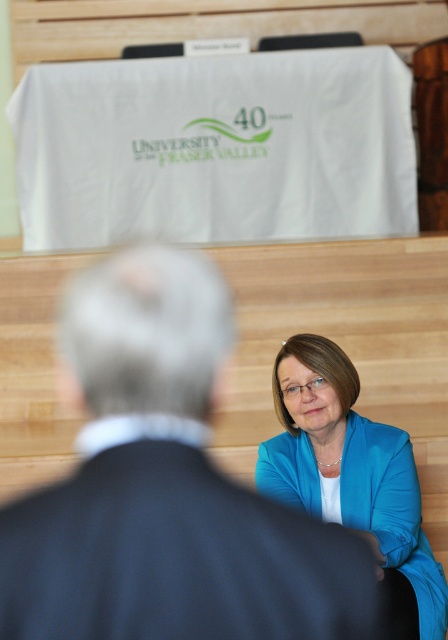
Is dark blue suit at center bigger than blue fabric jacket at lower right?

No.

Between point (73, 552) and point (276, 440), which one is positioned in front?

Point (73, 552) is more forward.

Does point (138, 557) lie behind point (266, 477)?

That is False.

Identify the location of dark blue suit at center. The image size is (448, 640). (164, 488).